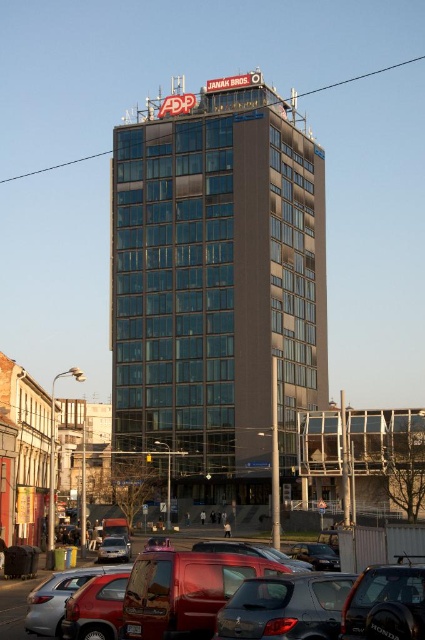
Question: Which of the following is the closest to the observer?

Choices:
 (A) (183, 387)
 (B) (306, 458)
 (C) (79, 577)

Answer: (C)

Question: Is transparent glass building at center closer to camera compared to matte red van at lower left?

Choices:
 (A) yes
 (B) no

Answer: (B)

Question: Among these objects, which one is farthest from the camera?

Choices:
 (A) matte gray building at lower left
 (B) transparent glass building at center

Answer: (B)

Question: Is the position of transparent glass building at center more distant than that of matte gray building at lower left?

Choices:
 (A) no
 (B) yes

Answer: (B)

Question: Is glassy gray building at center positioned behind matte black car at center?

Choices:
 (A) yes
 (B) no

Answer: (A)

Question: Which of the following is the farthest from the observer?

Choices:
 (A) transparent glass building at center
 (B) glassy gray building at center
 (C) matte red van at lower left
 (D) matte black car at center

Answer: (B)